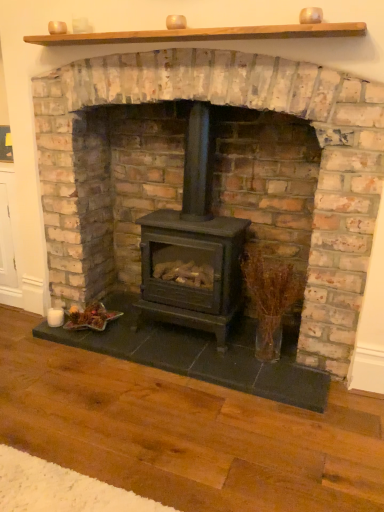
Where is `vacant region to the left of translucent glass vase at right`? The image size is (384, 512). vacant region to the left of translucent glass vase at right is located at coordinates [218, 355].